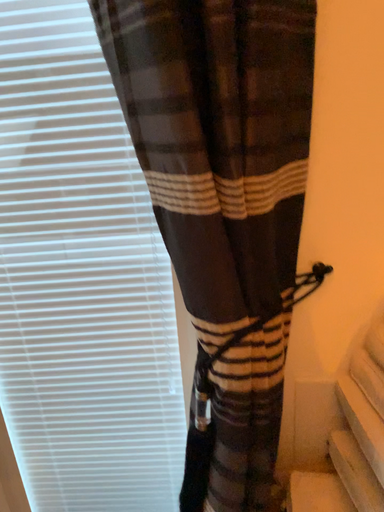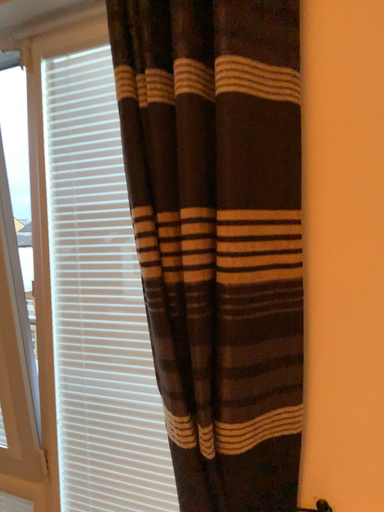
Question: How did the camera likely rotate when shooting the video?

Choices:
 (A) rotated upward
 (B) rotated downward

Answer: (A)